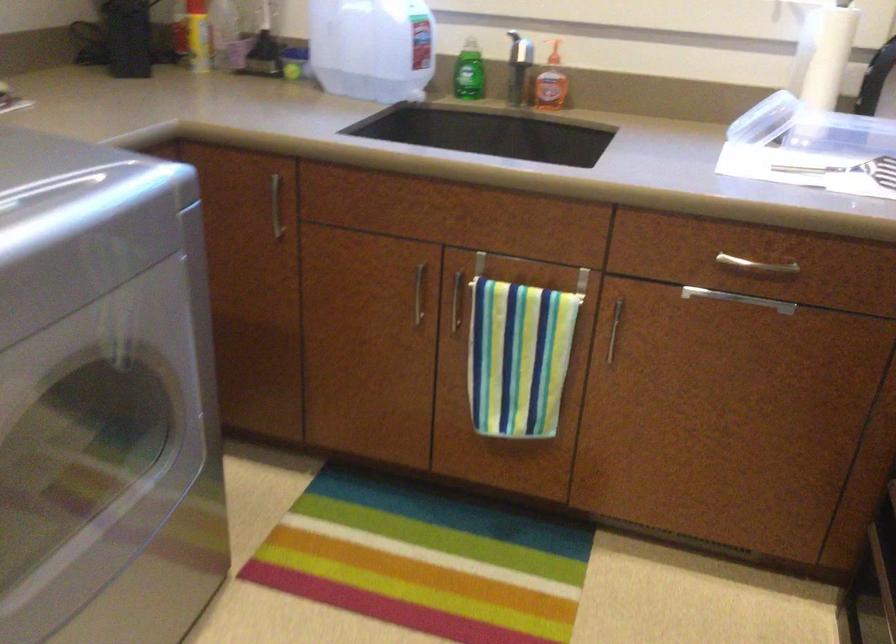
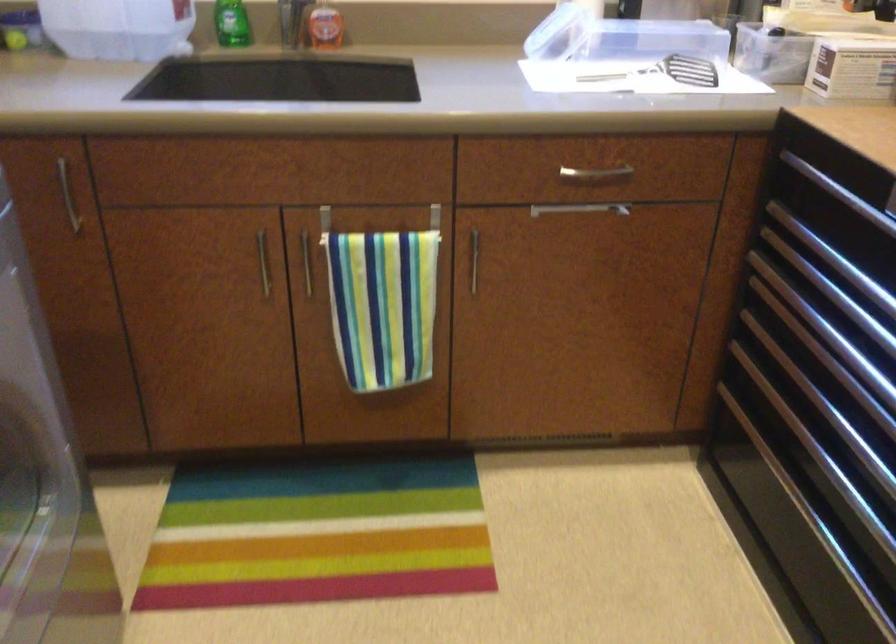
In the scene shown: In a continuous first-person perspective shot, in which direction is the camera moving?

The cameraman moved toward left, forward.